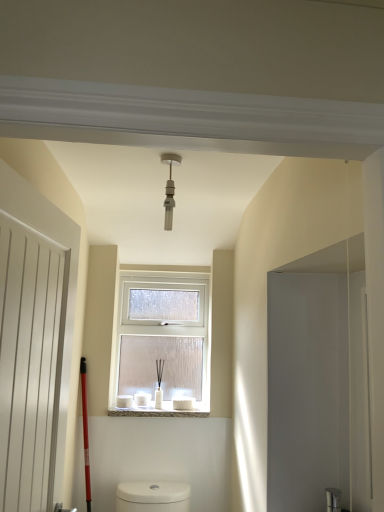
Question: From a real-world perspective, is white frosted glass window at center physically above white matte door at left?

Choices:
 (A) no
 (B) yes

Answer: (B)

Question: Is white frosted glass window at center to the right of white matte door at left from the viewer's perspective?

Choices:
 (A) no
 (B) yes

Answer: (B)

Question: Considering the relative positions of white frosted glass window at center and white matte door at left in the image provided, is white frosted glass window at center to the left of white matte door at left from the viewer's perspective?

Choices:
 (A) no
 (B) yes

Answer: (A)

Question: Is white frosted glass window at center looking in the opposite direction of white matte door at left?

Choices:
 (A) no
 (B) yes

Answer: (A)

Question: From the image's perspective, is white frosted glass window at center over white matte door at left?

Choices:
 (A) no
 (B) yes

Answer: (A)

Question: Considering their positions, is white marble window sill at center located in front of or behind white matte door at left?

Choices:
 (A) behind
 (B) front

Answer: (A)

Question: Considering the positions of white marble window sill at center and white matte door at left in the image, is white marble window sill at center taller or shorter than white matte door at left?

Choices:
 (A) tall
 (B) short

Answer: (B)

Question: From the image's perspective, is white marble window sill at center above or below white matte door at left?

Choices:
 (A) above
 (B) below

Answer: (B)

Question: Looking at their shapes, would you say white marble window sill at center is wider or thinner than white matte door at left?

Choices:
 (A) thin
 (B) wide

Answer: (B)

Question: From the image's perspective, is matte silver light fixture at center located above or below white marble window sill at center?

Choices:
 (A) below
 (B) above

Answer: (B)

Question: In the image, is matte silver light fixture at center on the left side or the right side of white marble window sill at center?

Choices:
 (A) right
 (B) left

Answer: (A)

Question: From a real-world perspective, is matte silver light fixture at center positioned above or below white marble window sill at center?

Choices:
 (A) below
 (B) above

Answer: (B)

Question: Is matte silver light fixture at center bigger or smaller than white marble window sill at center?

Choices:
 (A) big
 (B) small

Answer: (B)

Question: Is point (178, 394) closer or farther from the camera than point (193, 411)?

Choices:
 (A) farther
 (B) closer

Answer: (A)

Question: Which is correct: white frosted glass window at center is inside white marble window sill at center, or outside of it?

Choices:
 (A) inside
 (B) outside

Answer: (B)